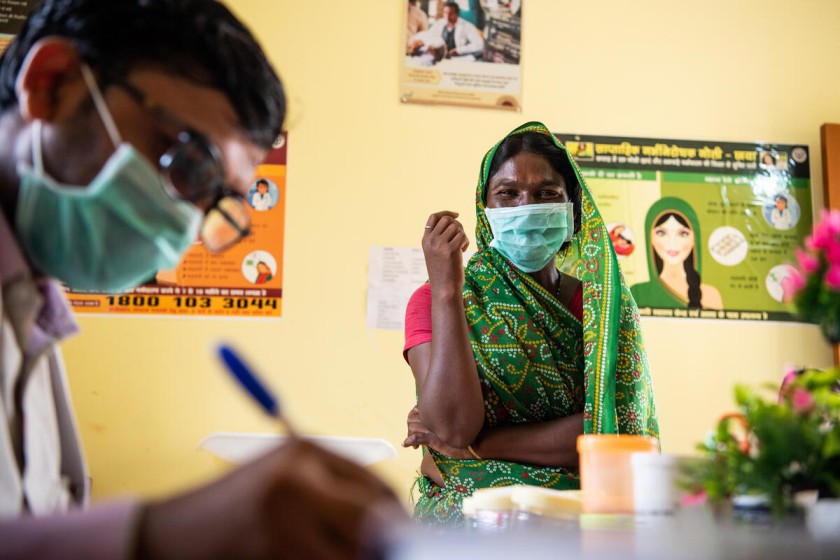
The height and width of the screenshot is (560, 840). In order to click on poster in this screenshot , I will do `click(701, 200)`.